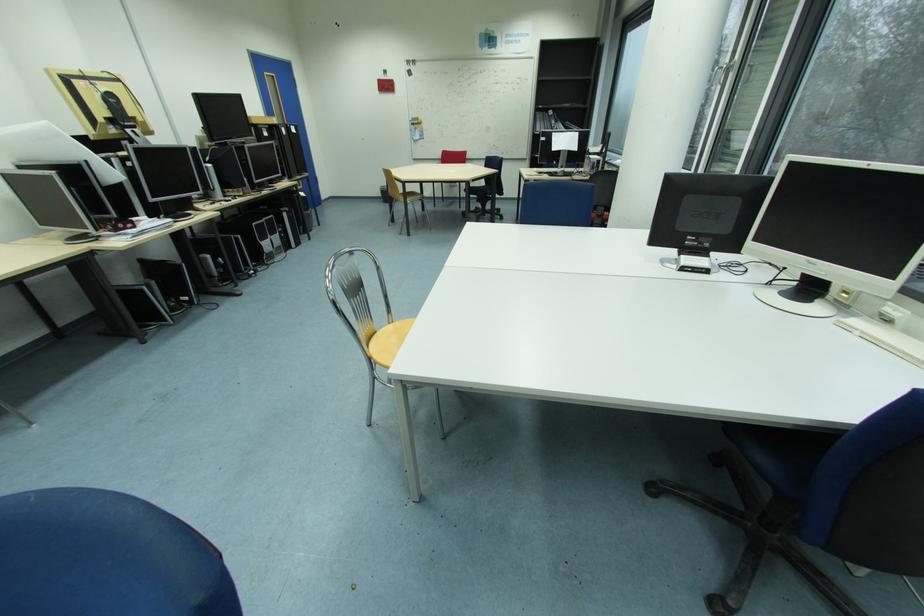
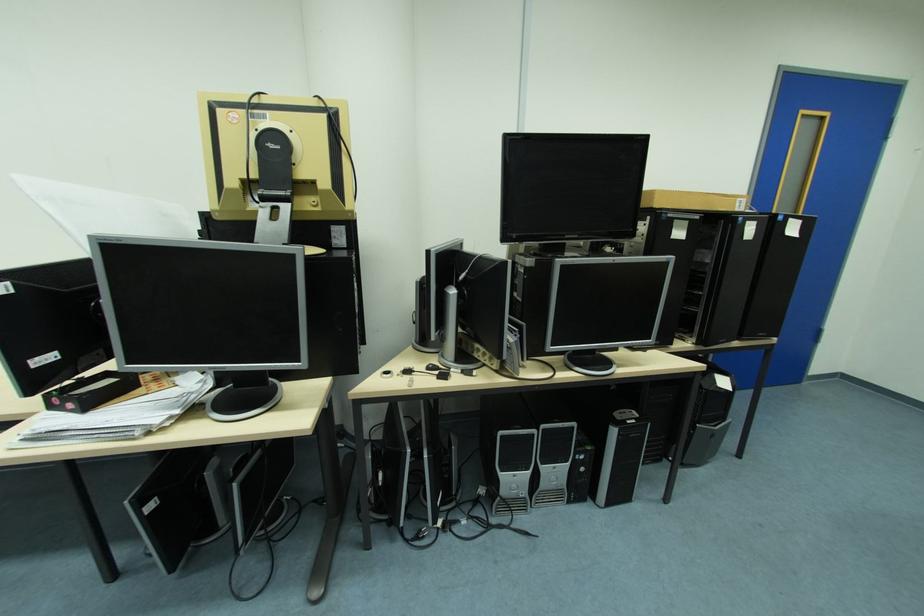
The point at (261, 225) is marked in the first image. Where is the corresponding point in the second image?

(507, 434)